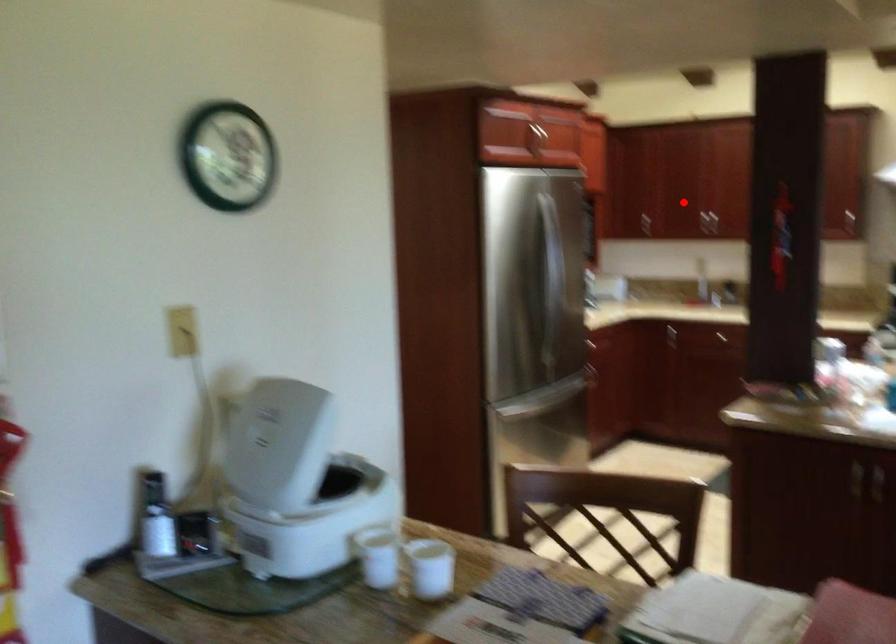
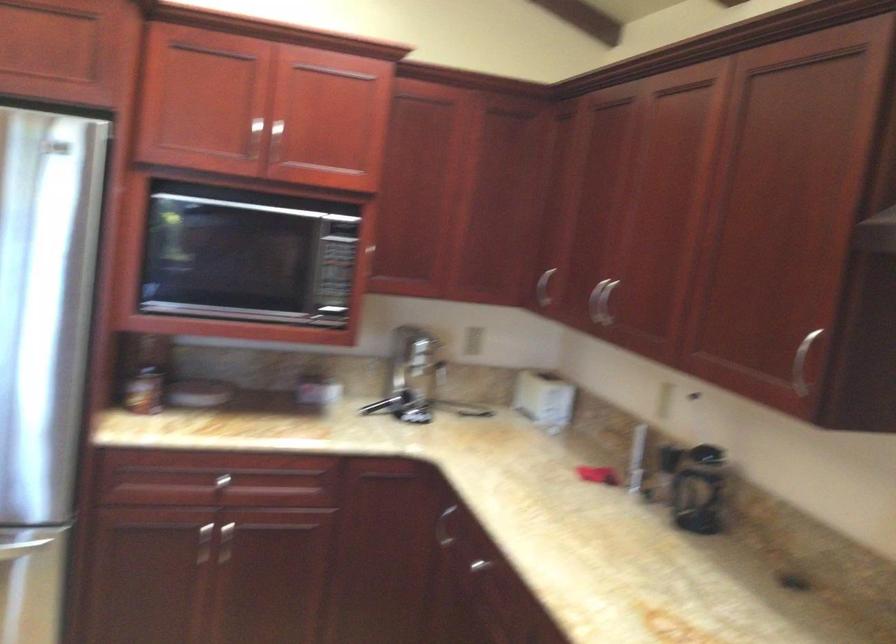
Question: I am providing you with two images of the same scene from different viewpoints. A red point is shown in image1. For the corresponding object point in image2, is it positioned nearer or farther from the camera?

Choices:
 (A) Nearer
 (B) Farther

Answer: (A)